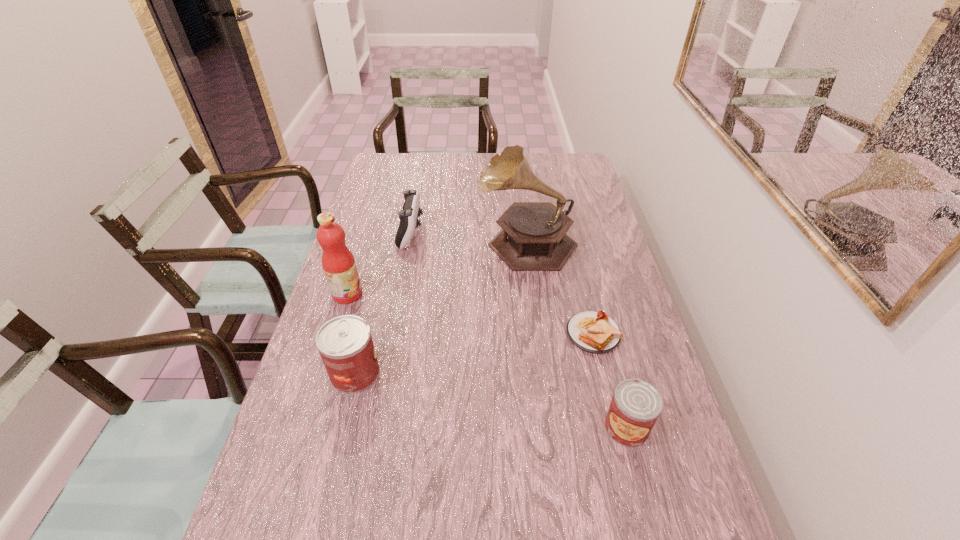
You are a GUI agent. You are given a task and a screenshot of the screen. Output one action in this format:
    pyautogui.click(x=<x>, y=<y>)
    Task: Click on the vacant region that satisfies the following two spatial constraints: 1. on the horn direction of the phonograph record; 2. on the back side of the shorter can
    The height and width of the screenshot is (540, 960).
    Given the screenshot: What is the action you would take?
    pyautogui.click(x=549, y=427)

This screenshot has width=960, height=540. Find the location of `free space that satisfies the following two spatial constraints: 1. on the front label of the fourth nearest object; 2. on the right side of the sandwich`. free space that satisfies the following two spatial constraints: 1. on the front label of the fourth nearest object; 2. on the right side of the sandwich is located at coordinates tap(335, 334).

I want to click on vacant region that satisfies the following two spatial constraints: 1. on the front-facing side of the control; 2. on the front side of the taller can, so click(385, 373).